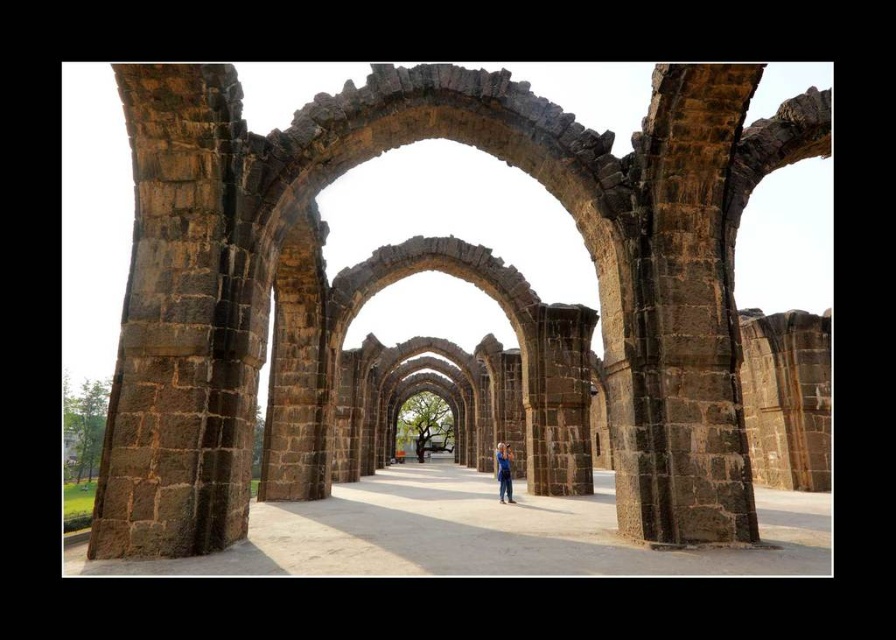
Question: Where is brown stone arches at center located in relation to blue denim jeans at center in the image?

Choices:
 (A) below
 (B) above

Answer: (B)

Question: Can you confirm if brown stone arches at center is positioned to the left of blue denim jeans at center?

Choices:
 (A) no
 (B) yes

Answer: (A)

Question: Can you confirm if brown stone arches at center is positioned to the right of blue denim jeans at center?

Choices:
 (A) no
 (B) yes

Answer: (B)

Question: Based on their relative distances, which object is farther from the blue denim jeans at center?

Choices:
 (A) brown stone arches at center
 (B) smooth concrete path at center

Answer: (A)

Question: Which point is farther to the camera?

Choices:
 (A) (755, 68)
 (B) (431, 504)

Answer: (B)

Question: Which of these objects is positioned farthest from the blue denim jeans at center?

Choices:
 (A) smooth concrete path at center
 (B) brown stone arches at center

Answer: (B)